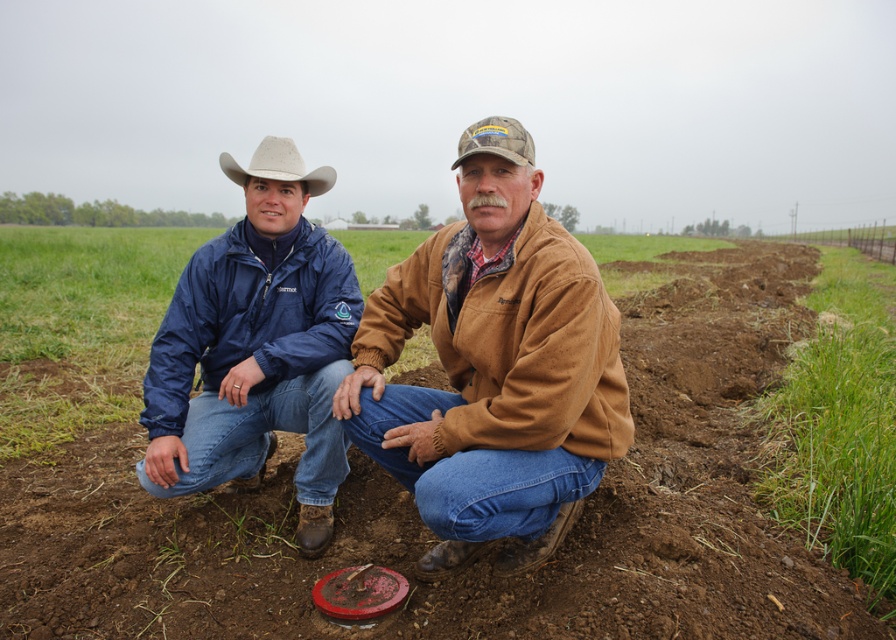
Does white felt cowboy hat at upper left appear on the left side of camo fabric cowboy hat at center?

Indeed, white felt cowboy hat at upper left is positioned on the left side of camo fabric cowboy hat at center.

Is white felt cowboy hat at upper left positioned in front of camo fabric cowboy hat at center?

No.

Which is behind, point (264, 148) or point (521, 125)?

Positioned behind is point (264, 148).

The width and height of the screenshot is (896, 640). I want to click on white felt cowboy hat at upper left, so click(x=278, y=164).

Does matte blue jacket at center have a lesser height compared to camo fabric cowboy hat at center?

Correct, matte blue jacket at center is not as tall as camo fabric cowboy hat at center.

Can you confirm if matte blue jacket at center is thinner than camo fabric cowboy hat at center?

Indeed, matte blue jacket at center has a lesser width compared to camo fabric cowboy hat at center.

Who is more forward, (212,321) or (520,131)?

Positioned in front is point (520,131).

Where is `matte blue jacket at center`? The image size is (896, 640). matte blue jacket at center is located at coordinates (256, 348).

Can you confirm if brown suede jacket at center is positioned to the left of matte blue jacket at center?

No, brown suede jacket at center is not to the left of matte blue jacket at center.

Locate an element on the screen. Image resolution: width=896 pixels, height=640 pixels. brown suede jacket at center is located at coordinates (493, 376).

Where is `brown suede jacket at center`? brown suede jacket at center is located at coordinates (493, 376).